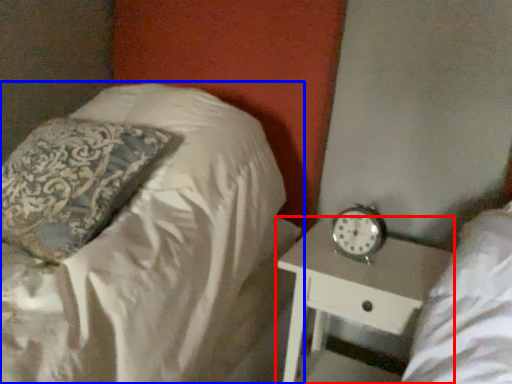
Question: Which object appears closest to the camera in this image, nightstand (highlighted by a red box) or bed (highlighted by a blue box)?

Choices:
 (A) nightstand
 (B) bed

Answer: (B)